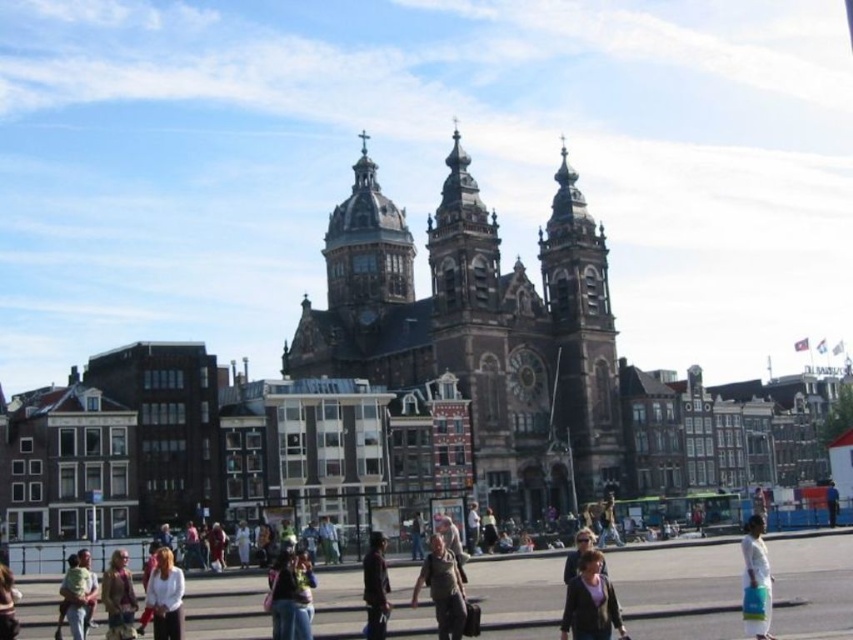
Question: Among these points, which one is nearest to the camera?

Choices:
 (A) (456, 348)
 (B) (618, 621)

Answer: (B)

Question: Can you confirm if dark brown leather jacket at lower left is positioned below light brown leather jacket at center?

Choices:
 (A) no
 (B) yes

Answer: (A)

Question: Is dark brown leather jacket at center below white matte jacket at lower right?

Choices:
 (A) no
 (B) yes

Answer: (A)

Question: Which point is farther from the camera taking this photo?

Choices:
 (A) (596, 611)
 (B) (155, 627)

Answer: (B)

Question: Which point is farther to the camera?

Choices:
 (A) (306, 608)
 (B) (86, 570)
 (C) (577, 531)
 (D) (119, 600)

Answer: (C)

Question: Is denim jacket at lower center closer to the viewer compared to light brown leather jacket at lower left?

Choices:
 (A) no
 (B) yes

Answer: (B)